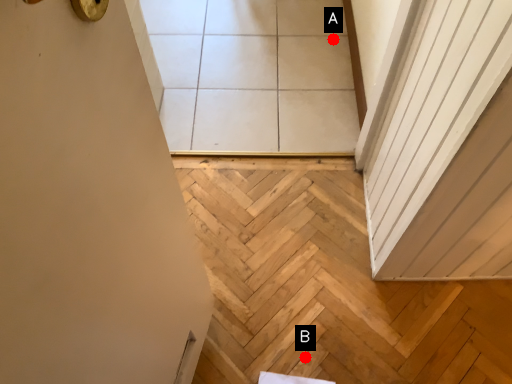
Question: Two points are circled on the image, labeled by A and B beside each circle. Among these points, which one is farthest from the camera?

Choices:
 (A) A is further
 (B) B is further

Answer: (A)